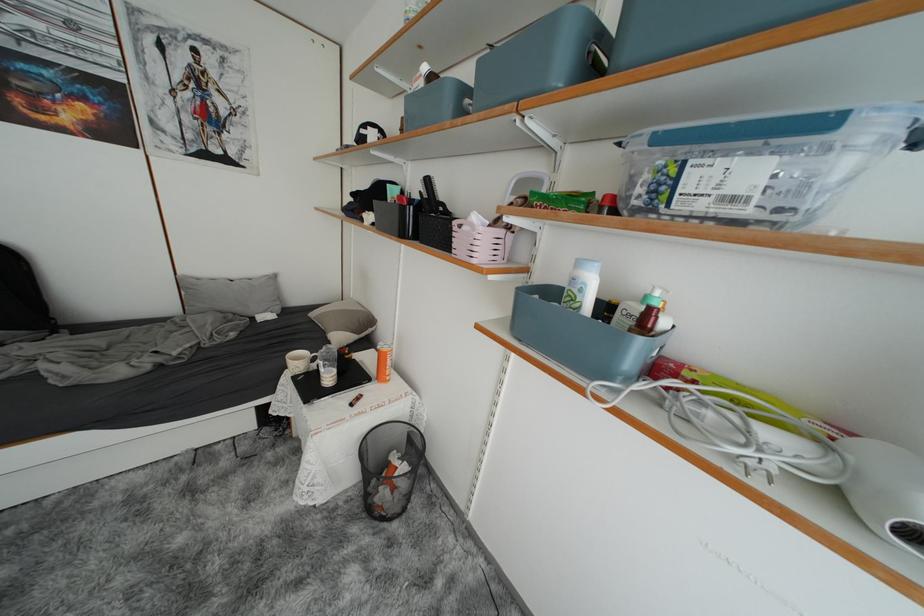
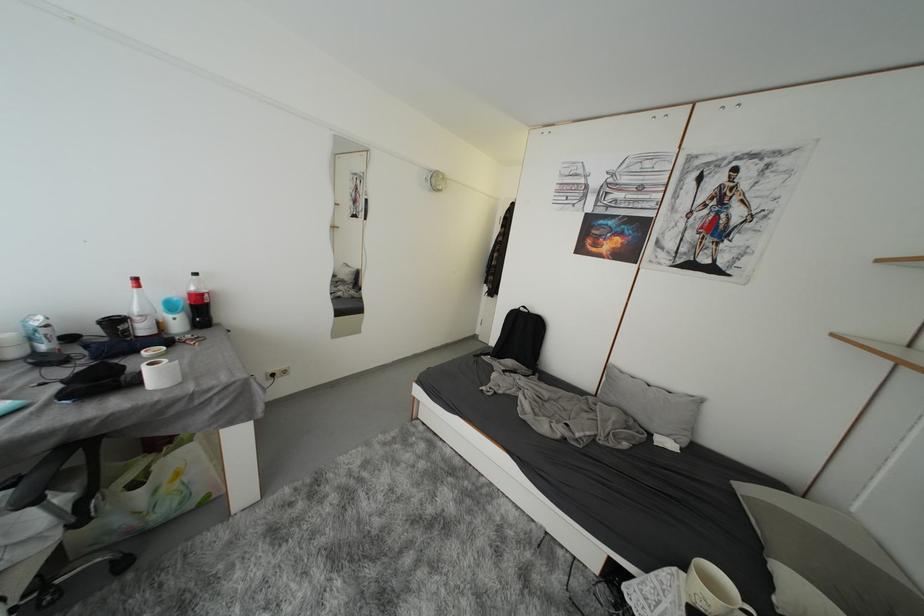
Question: Based on the continuous images, in which direction is the camera rotating? Reply with the corresponding letter.

Choices:
 (A) Left
 (B) Right
 (C) Up
 (D) Down

Answer: (A)